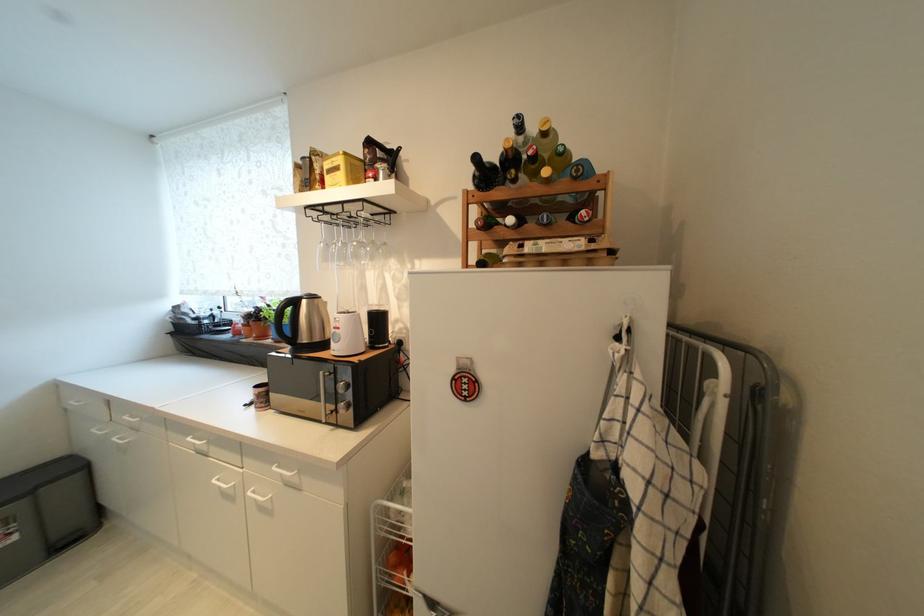
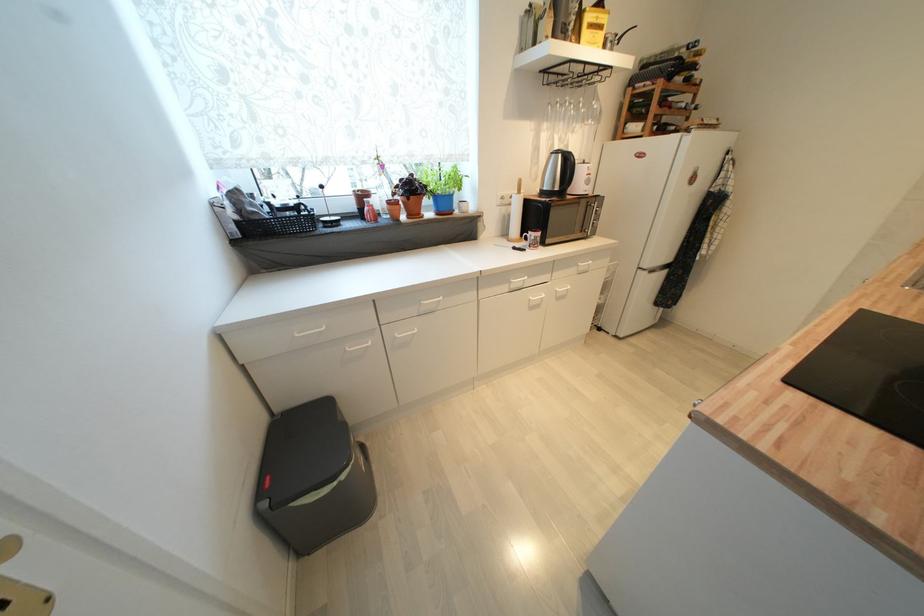
Find the pixel in the second image that matches the point at 179,325 in the first image.

(242, 225)